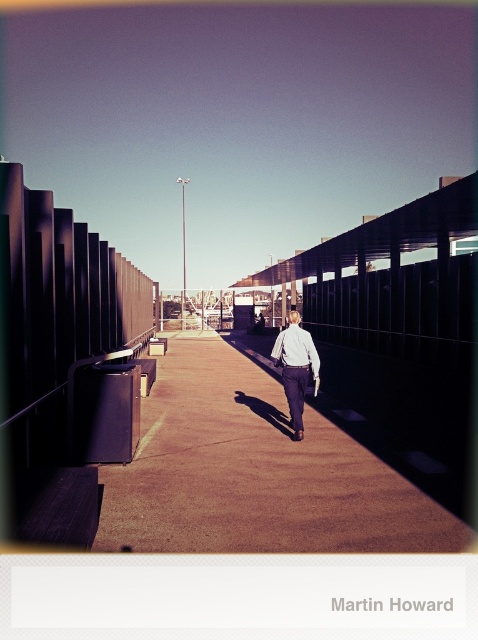
Question: Based on their relative distances, which object is farther from the white shirt at center?

Choices:
 (A) white matte shirt at center
 (B) brown concrete pavement at center

Answer: (B)

Question: Does brown concrete pavement at center appear under white matte shirt at center?

Choices:
 (A) no
 (B) yes

Answer: (B)

Question: Among these objects, which one is nearest to the camera?

Choices:
 (A) brown concrete pavement at center
 (B) white matte shirt at center

Answer: (A)

Question: In this image, where is brown concrete pavement at center located relative to white shirt at center?

Choices:
 (A) right
 (B) left

Answer: (B)

Question: Considering the real-world distances, which object is closest to the white shirt at center?

Choices:
 (A) brown concrete pavement at center
 (B) white matte shirt at center

Answer: (B)

Question: Is brown concrete pavement at center bigger than white matte shirt at center?

Choices:
 (A) no
 (B) yes

Answer: (B)